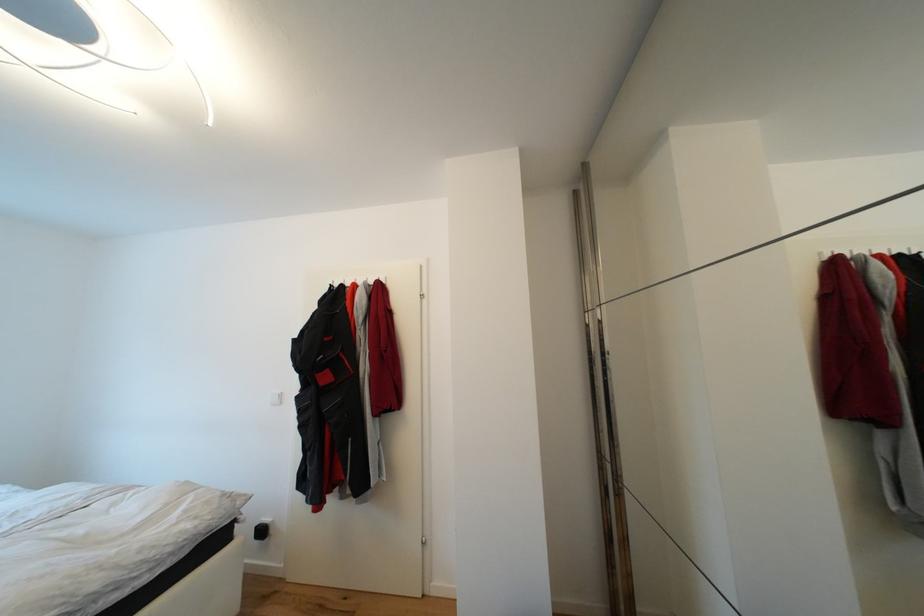
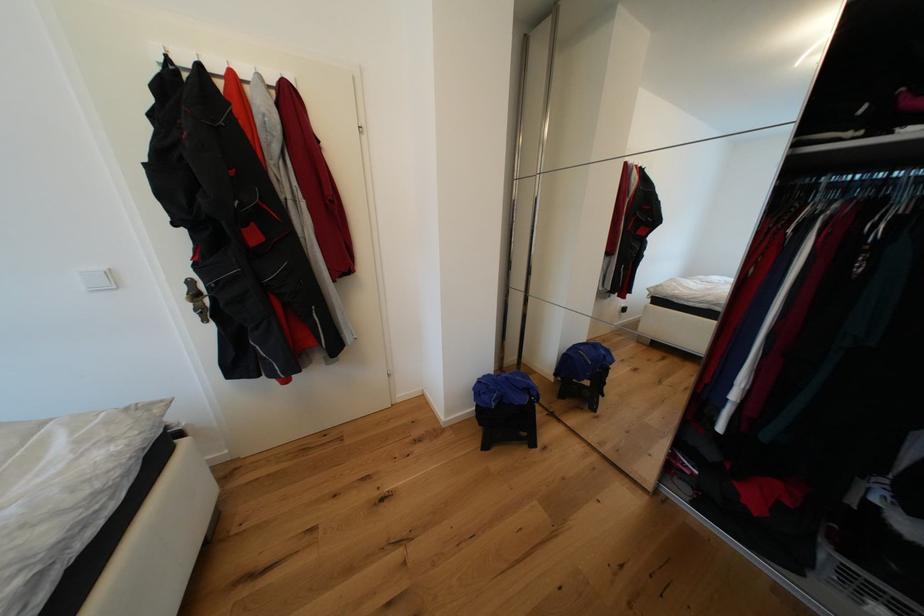
How did the camera likely rotate?

The camera's rotation is toward right-down.